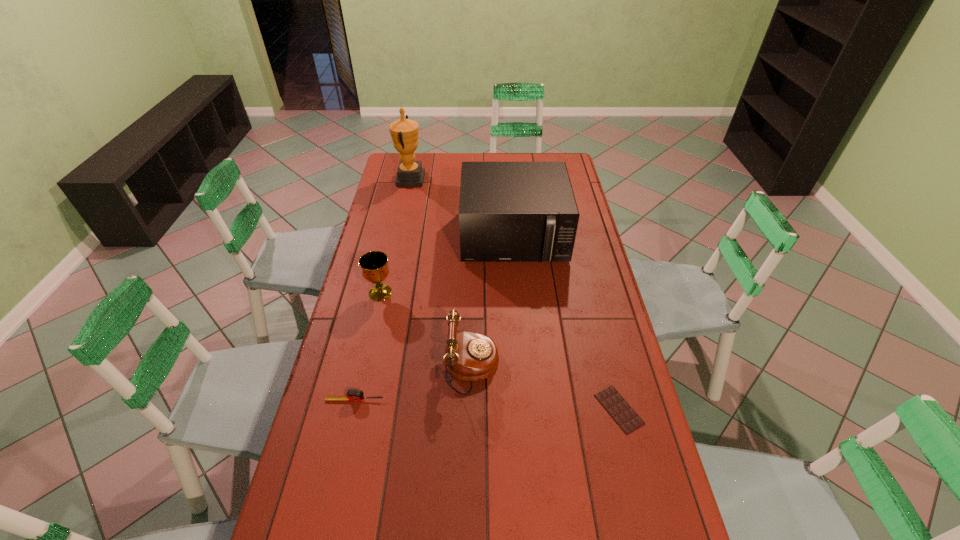
I want to click on vacant area situated on the right of the third farthest object, so click(x=425, y=293).

Locate an element on the screen. The height and width of the screenshot is (540, 960). free space located 0.210m on the dial of the telephone is located at coordinates (567, 366).

At what (x,y) coordinates should I click in order to perform the action: click on free location located 0.360m on the back of the tape measure. Please return your answer as a coordinate pair (x, y). Looking at the image, I should click on (376, 305).

This screenshot has width=960, height=540. I want to click on free region located on the front of the shortest object, so click(x=638, y=488).

Where is `object that is positioned at the far edge`? The image size is (960, 540). object that is positioned at the far edge is located at coordinates (404, 132).

This screenshot has height=540, width=960. I want to click on award that is at the left edge, so click(404, 132).

The image size is (960, 540). I want to click on chalice that is at the left edge, so click(x=374, y=264).

Locate an element on the screen. The width and height of the screenshot is (960, 540). tape measure present at the left edge is located at coordinates (353, 395).

Locate an element on the screen. microwave oven that is at the right edge is located at coordinates (508, 211).

Identify the location of chocolate bar present at the right edge. This screenshot has height=540, width=960. (623, 414).